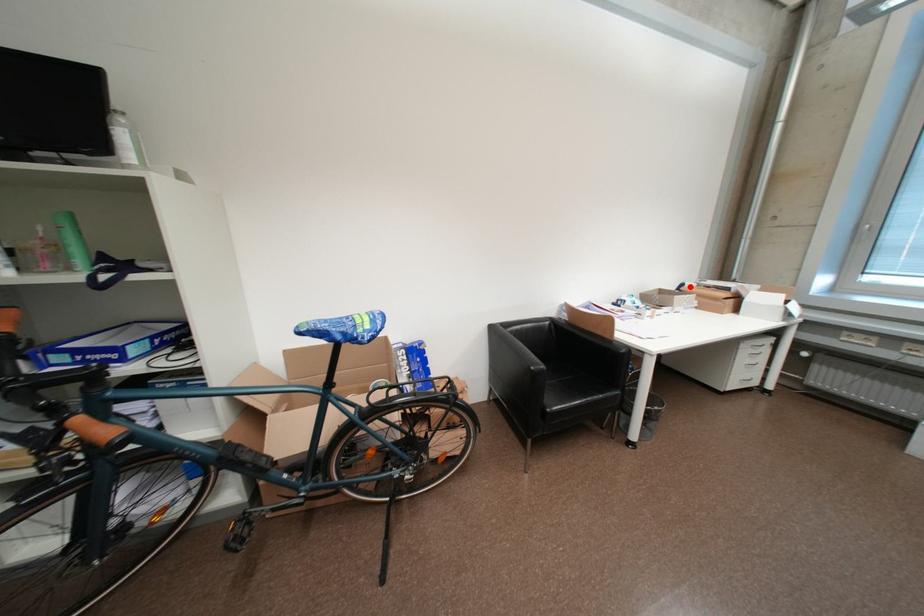
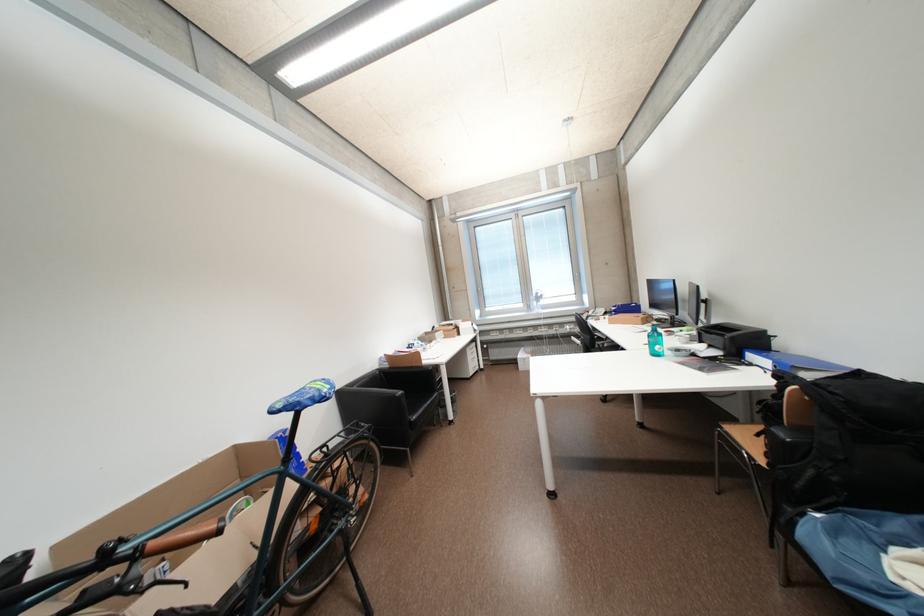
Locate, in the second image, the point that corresponds to the highlighted location in the first image.

(442, 330)